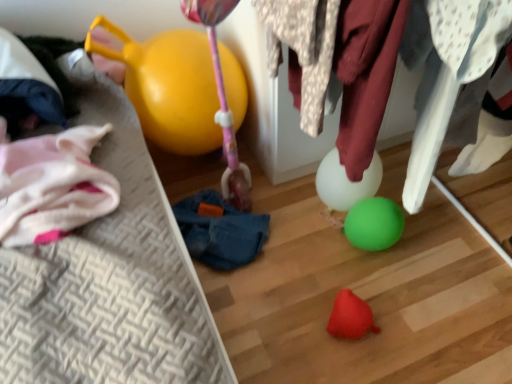
Where is `vacant space to the left of rubber red toy at lower center`? vacant space to the left of rubber red toy at lower center is located at coordinates (289, 325).